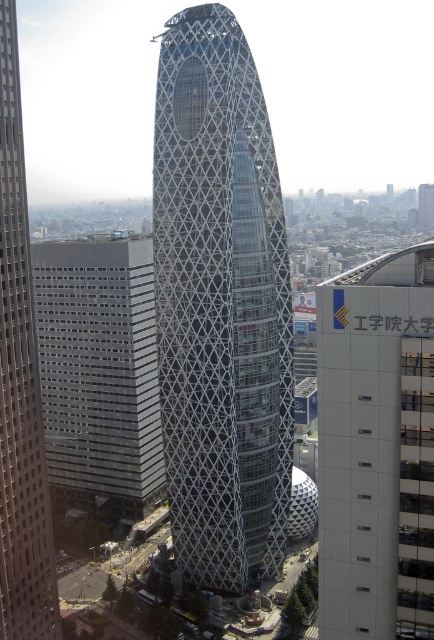
You are an architect evaluating the scale of structures in this cityscape. Given that the metallic lattice tower at center and the white concrete building at right are both visible from your viewpoint, which structure would you describe as having a larger overall size?

The metallic lattice tower at center is bigger than the white concrete building at right, so it has a larger overall size.

You are an architect analyzing the skyline of this city. You observe the metallic lattice tower at center and the gray glass building at left. Which one appears taller in the image?

The metallic lattice tower at center appears taller than the gray glass building at left as it has a greater height compared to it according to the description.

You are an architect analyzing the layout of this city block. Given the white concrete building at right and the gray glass building at left, which one has a smaller footprint in terms of width?

The white concrete building at right has a smaller footprint in terms of width than the gray glass building at left.